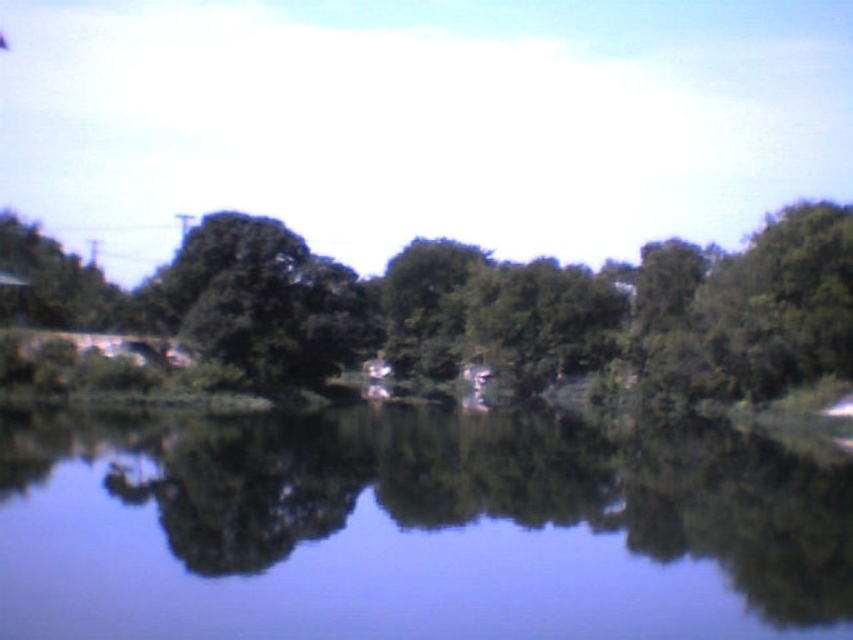
You are standing at the edge of the lake and see the point labeled as point (415,531). Can you see through the water at that point?

Yes, the point (415,531) indicates transparent water at center, so you can see through the water there.

You are standing at the edge of the lake and want to walk across to the other side. The transparent water at center is narrower than the green leafy tree at center. Can you cross the water without getting wet?

The transparent water at center is narrower than the green leafy tree at center, so it might be possible to cross without getting wet if the water is shallow enough. However, the description does not provide information about the depth or safety of the water.

You are standing on the edge of the lake and see the transparent water at center and the green leafy tree at center. Which object is closer to the ground?

The transparent water at center is below green leafy tree at center, so it is closer to the ground than the tree.